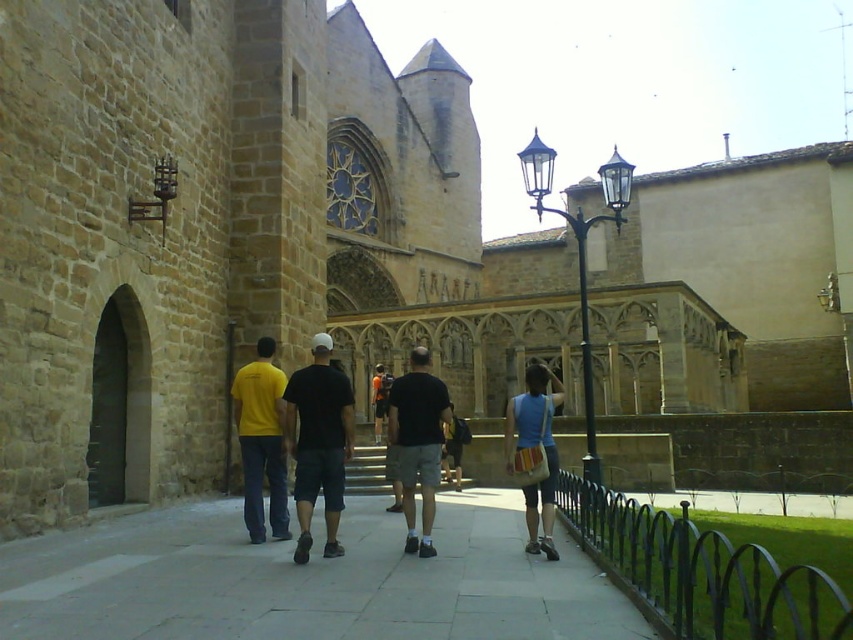
You are standing at the point with coordinates point (515, 470) and want to walk to the point with coordinates point (254, 442). Given the layout of the historic stone building and the paved walkway, will you have to walk towards the building or away from it?

Since point (254, 442) is behind point (515, 470), you would need to walk towards the historic stone building to reach it.

You are standing on the paved walkway in front of the historic stone building and want to move towards the point closer to the camera between the two points marked as point (318, 342) and point (260, 419). Which point should you head towards?

You should head towards point (318, 342) because it is closer to you than point (260, 419).